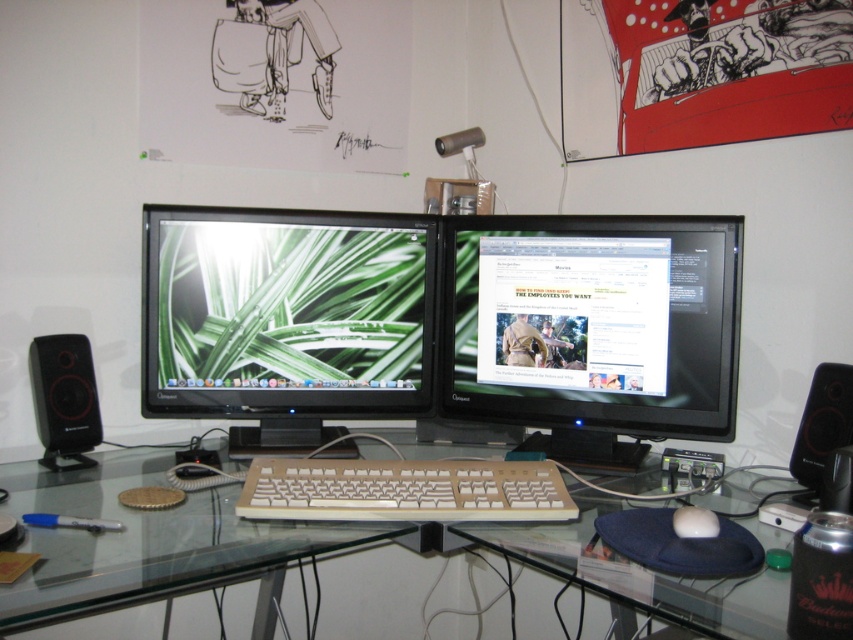
Does point (503, 378) come behind point (815, 401)?

Yes, point (503, 378) is farther from viewer.

Which is behind, point (502, 403) or point (788, 467)?

Positioned behind is point (502, 403).

At what (x,y) coordinates should I click in order to perform the action: click on black glossy monitor at center. Please return your answer as a coordinate pair (x, y). Looking at the image, I should click on (593, 323).

Locate an element on the screen. black matte speaker at left is located at coordinates (64, 400).

This screenshot has height=640, width=853. I want to click on black matte speaker at left, so click(64, 400).

Which is below, white plastic keyboard at center or black matte speaker at left?

Positioned lower is white plastic keyboard at center.

Between white plastic keyboard at center and black matte speaker at left, which one appears on the left side from the viewer's perspective?

black matte speaker at left

Identify the location of white plastic keyboard at center. (404, 490).